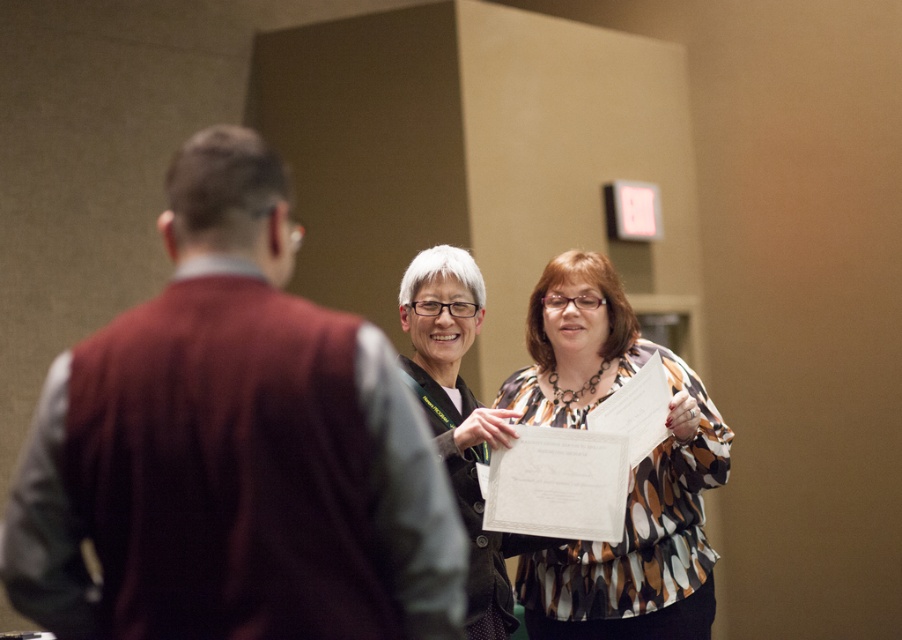
Question: Which of the following is the closest to the observer?

Choices:
 (A) (424, 317)
 (B) (183, 618)
 (C) (539, 333)

Answer: (B)

Question: Is multicolored printed blouse at center below matte black jacket at center?

Choices:
 (A) no
 (B) yes

Answer: (B)

Question: Is maroon sweater at left above multicolored printed blouse at center?

Choices:
 (A) yes
 (B) no

Answer: (A)

Question: Which object is closer to the camera taking this photo?

Choices:
 (A) multicolored printed blouse at center
 (B) matte black jacket at center
 (C) maroon sweater at left

Answer: (C)

Question: Considering the relative positions of maroon sweater at left and multicolored printed blouse at center in the image provided, where is maroon sweater at left located with respect to multicolored printed blouse at center?

Choices:
 (A) left
 (B) right

Answer: (A)

Question: Considering the real-world distances, which object is farthest from the multicolored printed blouse at center?

Choices:
 (A) maroon sweater at left
 (B) matte black jacket at center

Answer: (A)